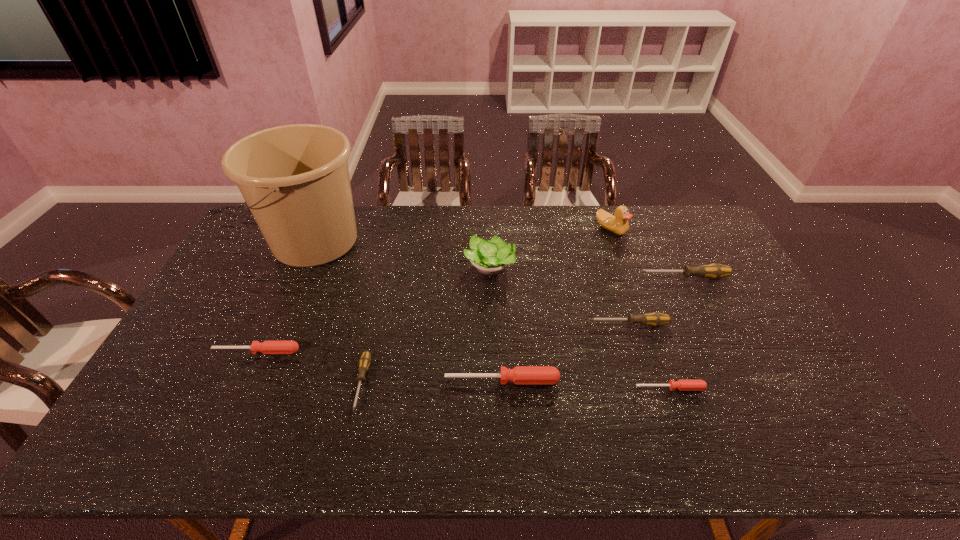
Identify the location of free space located 0.250m on the back of the smallest red screwdriver. (643, 313).

The width and height of the screenshot is (960, 540). I want to click on bucket located in the far edge section of the desktop, so click(x=295, y=179).

Where is `duck present at the far edge`? Image resolution: width=960 pixels, height=540 pixels. duck present at the far edge is located at coordinates coord(618,224).

Identify the location of bucket positioned at the left edge. This screenshot has width=960, height=540. (295, 179).

This screenshot has width=960, height=540. Find the location of `screwdriver that is at the left edge`. screwdriver that is at the left edge is located at coordinates (267, 347).

Locate an element on the screen. object situated at the right edge is located at coordinates (714, 271).

Locate an element on the screen. The image size is (960, 540). object that is positioned at the far left corner is located at coordinates (295, 179).

The image size is (960, 540). In the image, there is a desktop. What are the coordinates of `vacant space at the far edge` in the screenshot? It's located at (548, 213).

In the image, there is a desktop. Identify the location of free space at the near edge. (654, 457).

Image resolution: width=960 pixels, height=540 pixels. I want to click on vacant area at the right edge, so click(755, 363).